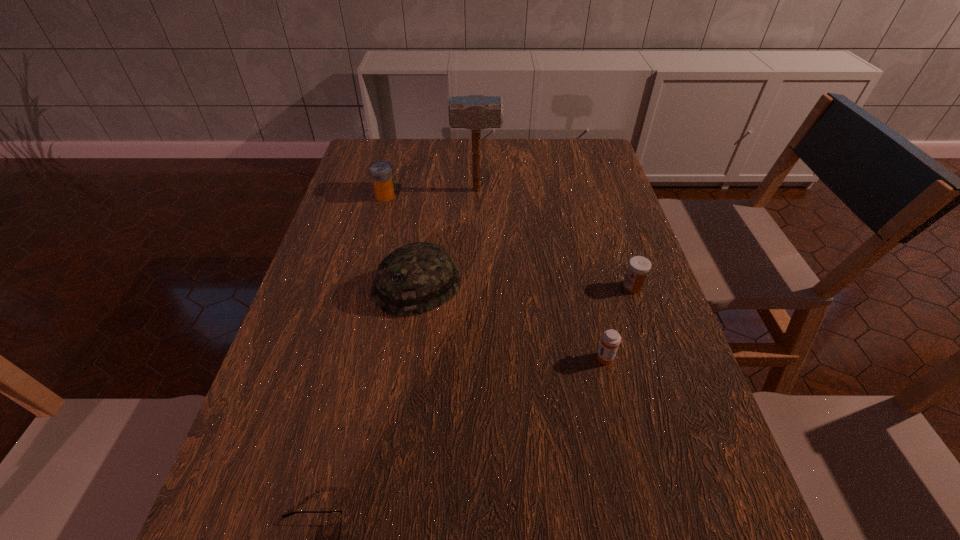
You are a GUI agent. You are given a task and a screenshot of the screen. Output one action in this format:
    pyautogui.click(x=<x>, y=<y>)
    Task: Click on the blank area located 0.060m on the label side of the farthest medicine
    The height and width of the screenshot is (540, 960).
    Given the screenshot: What is the action you would take?
    (416, 196)

Locate an element on the screen. vacant space situated 0.070m on the front of the fifth farthest object is located at coordinates (613, 396).

What are the coordinates of `free spot located on the left of the second farthest medicine` in the screenshot? It's located at (523, 287).

This screenshot has width=960, height=540. I want to click on object that is positioned at the left edge, so click(381, 172).

Locate an element on the screen. vacant area at the far edge is located at coordinates (460, 148).

At what (x,y) coordinates should I click in order to perform the action: click on free region at the left edge of the desktop. Please return your answer as a coordinate pair (x, y). This screenshot has width=960, height=540. Looking at the image, I should click on (304, 330).

Locate an element on the screen. This screenshot has height=540, width=960. free spot at the right edge of the desktop is located at coordinates (626, 252).

In the image, there is a desktop. What are the coordinates of `free region at the far right corner` in the screenshot? It's located at (553, 139).

Where is `free space that is in between the tallest object and the farthest medicine`? Image resolution: width=960 pixels, height=540 pixels. free space that is in between the tallest object and the farthest medicine is located at coordinates (431, 193).

You are a GUI agent. You are given a task and a screenshot of the screen. Output one action in this format:
    pyautogui.click(x=<x>, y=<y>)
    Task: Click on the free point between the mallet and the second farthest medicine
    The height and width of the screenshot is (540, 960).
    Given the screenshot: What is the action you would take?
    pyautogui.click(x=554, y=239)